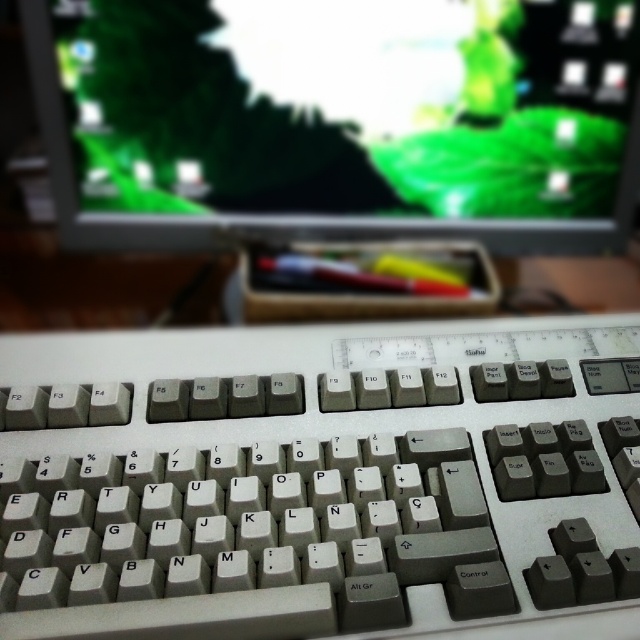
Is white plastic keyboard at center positioned before matte plastic monitor at upper center?

Yes, it is in front of matte plastic monitor at upper center.

Between white plastic keyboard at center and matte plastic monitor at upper center, which one appears on the left side from the viewer's perspective?

white plastic keyboard at center is more to the left.

Does point (102, 512) come closer to viewer compared to point (401, 161)?

Yes, point (102, 512) is in front of point (401, 161).

Find the location of a particular element. The height and width of the screenshot is (640, 640). white plastic keyboard at center is located at coordinates (316, 477).